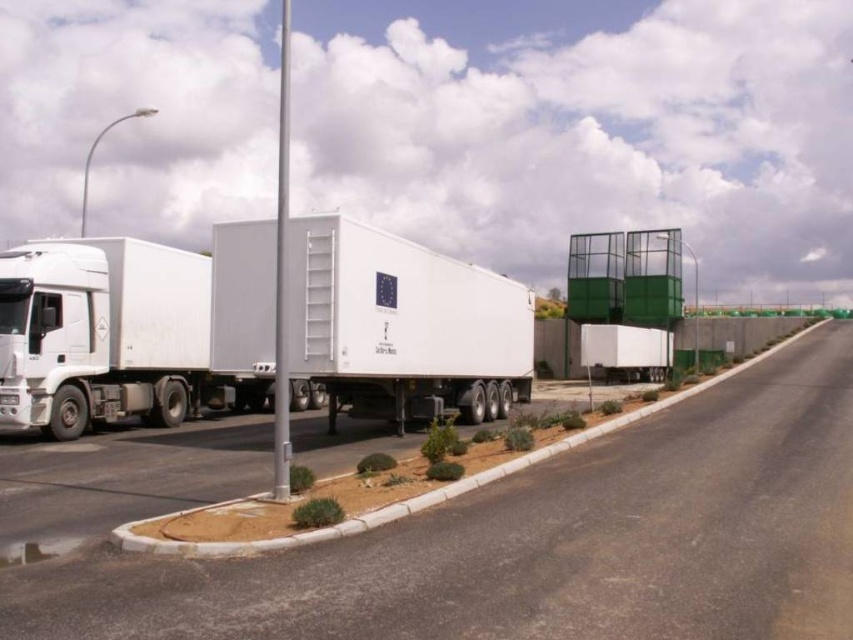
Question: Is asphalt road at center wider than white matte trailer truck at left?

Choices:
 (A) yes
 (B) no

Answer: (A)

Question: Among these points, which one is nearest to the camera?

Choices:
 (A) (213, 275)
 (B) (22, 413)

Answer: (B)

Question: Which of the following is the farthest from the observer?

Choices:
 (A) (416, 413)
 (B) (102, 321)

Answer: (A)

Question: Is asphalt road at center thinner than white matte trailer truck at left?

Choices:
 (A) yes
 (B) no

Answer: (B)

Question: Which object is positioned closest to the asphalt road at center?

Choices:
 (A) white matte trailer truck at left
 (B) white matte trailer truck at center

Answer: (B)

Question: Can you confirm if asphalt road at center is positioned above white matte trailer truck at center?

Choices:
 (A) yes
 (B) no

Answer: (B)